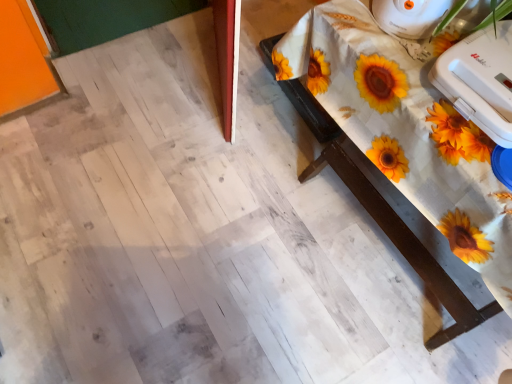
Question: Does white plastic iron at upper right, the 1th appliance positioned from the top, turn towards white plastic toaster at upper right, arranged as the 1th appliance when ordered from the bottom?

Choices:
 (A) no
 (B) yes

Answer: (A)

Question: From the image's perspective, is white plastic iron at upper right, positioned as the second appliance in bottom-to-top order, located beneath white plastic toaster at upper right, which is the second appliance from top to bottom?

Choices:
 (A) no
 (B) yes

Answer: (A)

Question: Does white plastic iron at upper right, positioned as the second appliance in bottom-to-top order, have a greater height compared to white plastic toaster at upper right, arranged as the 1th appliance when ordered from the bottom?

Choices:
 (A) yes
 (B) no

Answer: (A)

Question: Considering the relative positions of white plastic iron at upper right, the 1th appliance positioned from the top, and white plastic toaster at upper right, arranged as the 1th appliance when ordered from the bottom, in the image provided, is white plastic iron at upper right, the 1th appliance positioned from the top, to the right of white plastic toaster at upper right, arranged as the 1th appliance when ordered from the bottom, from the viewer's perspective?

Choices:
 (A) yes
 (B) no

Answer: (B)

Question: From the image's perspective, is white plastic iron at upper right, positioned as the second appliance in bottom-to-top order, located above white plastic toaster at upper right, which is the second appliance from top to bottom?

Choices:
 (A) yes
 (B) no

Answer: (A)

Question: Does white plastic iron at upper right, the 1th appliance positioned from the top, have a larger size compared to white plastic toaster at upper right, arranged as the 1th appliance when ordered from the bottom?

Choices:
 (A) yes
 (B) no

Answer: (B)

Question: Does white plastic iron at upper right, the 1th appliance positioned from the top, touch white wood table at upper right?

Choices:
 (A) yes
 (B) no

Answer: (B)

Question: Is white plastic iron at upper right, the 1th appliance positioned from the top, oriented away from white wood table at upper right?

Choices:
 (A) yes
 (B) no

Answer: (B)

Question: Considering the relative sizes of white plastic iron at upper right, positioned as the second appliance in bottom-to-top order, and white wood table at upper right in the image provided, is white plastic iron at upper right, positioned as the second appliance in bottom-to-top order, taller than white wood table at upper right?

Choices:
 (A) no
 (B) yes

Answer: (A)

Question: Is white plastic iron at upper right, positioned as the second appliance in bottom-to-top order, aimed at white wood table at upper right?

Choices:
 (A) no
 (B) yes

Answer: (A)

Question: Does white plastic iron at upper right, positioned as the second appliance in bottom-to-top order, have a greater width compared to white wood table at upper right?

Choices:
 (A) yes
 (B) no

Answer: (B)

Question: From a real-world perspective, is white plastic iron at upper right, positioned as the second appliance in bottom-to-top order, below white wood table at upper right?

Choices:
 (A) no
 (B) yes

Answer: (A)

Question: From a real-world perspective, is white wood table at upper right below white plastic toaster at upper right, which is the second appliance from top to bottom?

Choices:
 (A) no
 (B) yes

Answer: (B)